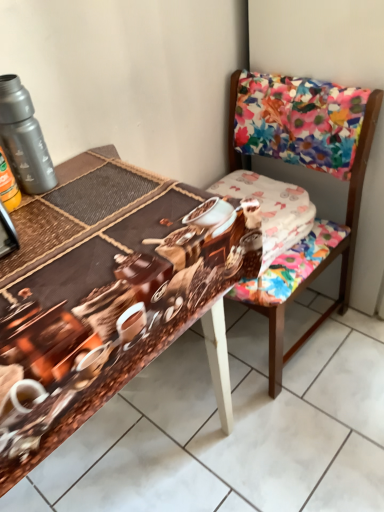
At what (x,y) coordinates should I click in order to perform the action: click on metallic gray thermos at upper left. Please return your answer as a coordinate pair (x, y). The height and width of the screenshot is (512, 384). Looking at the image, I should click on [24, 138].

The image size is (384, 512). Identify the location of brown printed fabric at center. (85, 245).

Is point (284, 229) closer or farther from the camera than point (21, 140)?

Point (284, 229) is positioned farther from the camera compared to point (21, 140).

Is white cotton fabric at center not close to metallic gray thermos at upper left?

white cotton fabric at center is near metallic gray thermos at upper left, not far away.

In terms of size, does white cotton fabric at center appear bigger or smaller than metallic gray thermos at upper left?

Clearly, white cotton fabric at center is larger in size than metallic gray thermos at upper left.

Measure the distance from white cotton fabric at center to metallic gray thermos at upper left.

A distance of 21.74 inches exists between white cotton fabric at center and metallic gray thermos at upper left.

The width and height of the screenshot is (384, 512). In order to click on table on the left of floral fabric chair at upper right in this screenshot , I will do `click(85, 245)`.

In the scene shown: Considering the relative positions of floral fabric chair at upper right and brown printed fabric at center in the image provided, is floral fabric chair at upper right in front of brown printed fabric at center?

No, floral fabric chair at upper right is further to the viewer.

Based on the photo, is brown printed fabric at center at the back of floral fabric chair at upper right?

That's not correct — floral fabric chair at upper right is not looking away from brown printed fabric at center.

From the image's perspective, is floral fabric chair at upper right under brown printed fabric at center?

No, from the image's perspective, floral fabric chair at upper right is not below brown printed fabric at center.

From the picture: From the image's perspective, who appears lower, metallic gray thermos at upper left or floral fabric chair at upper right?

floral fabric chair at upper right.

Which of these two, metallic gray thermos at upper left or floral fabric chair at upper right, stands taller?

With more height is floral fabric chair at upper right.

Is floral fabric chair at upper right at the back of metallic gray thermos at upper left?

No, metallic gray thermos at upper left is not facing the opposite direction of floral fabric chair at upper right.

Locate an element on the screen. chair behind the metallic gray thermos at upper left is located at coordinates (321, 259).

Is metallic gray thermos at upper left completely or partially inside brown printed fabric at center?

No, metallic gray thermos at upper left is not surrounded by brown printed fabric at center.

Is brown printed fabric at center facing away from metallic gray thermos at upper left?

brown printed fabric at center does not have its back to metallic gray thermos at upper left.

From the image's perspective, which is below, brown printed fabric at center or metallic gray thermos at upper left?

brown printed fabric at center appears lower in the image.

Where is `bottle that is above the brown printed fabric at center (from the image's perspective)`? bottle that is above the brown printed fabric at center (from the image's perspective) is located at coordinates (24, 138).

The width and height of the screenshot is (384, 512). Identify the location of fabric that is above the brown printed fabric at center (from the image's perspective). [x=272, y=209].

Considering the relative sizes of brown printed fabric at center and white cotton fabric at center in the image provided, is brown printed fabric at center taller than white cotton fabric at center?

Yes, brown printed fabric at center is taller than white cotton fabric at center.

How many degrees apart are the facing directions of brown printed fabric at center and white cotton fabric at center?

The facing directions of brown printed fabric at center and white cotton fabric at center are 0.97 degrees apart.

Which point is more forward, (138, 232) or (214, 187)?

The point (138, 232) is in front.

From the image's perspective, is floral fabric chair at upper right located beneath white cotton fabric at center?

Correct, floral fabric chair at upper right appears lower than white cotton fabric at center in the image.

Does floral fabric chair at upper right have a larger size compared to white cotton fabric at center?

Correct, floral fabric chair at upper right is larger in size than white cotton fabric at center.

How many degrees apart are the facing directions of floral fabric chair at upper right and white cotton fabric at center?

89 degrees.

From the image's perspective, which one is positioned higher, metallic gray thermos at upper left or brown printed fabric at center?

metallic gray thermos at upper left appears higher in the image.

Is metallic gray thermos at upper left situated inside brown printed fabric at center or outside?

metallic gray thermos at upper left lies outside brown printed fabric at center.

Is metallic gray thermos at upper left to the left or to the right of brown printed fabric at center in the image?

Based on their positions, metallic gray thermos at upper left is located to the left of brown printed fabric at center.

Can you tell me how much metallic gray thermos at upper left and brown printed fabric at center differ in facing direction?

metallic gray thermos at upper left and brown printed fabric at center are facing 0.000691 degrees away from each other.

Locate an element on the screen. Image resolution: width=384 pixels, height=512 pixels. fabric below the metallic gray thermos at upper left (from the image's perspective) is located at coordinates (272, 209).

The image size is (384, 512). What are the coordinates of `chair that is above the brown printed fabric at center (from a real-world perspective)` in the screenshot? It's located at [321, 259].

Considering their positions, is metallic gray thermos at upper left positioned closer to floral fabric chair at upper right than white cotton fabric at center?

white cotton fabric at center is closer to floral fabric chair at upper right.

Estimate the real-world distances between objects in this image. Which object is closer to metallic gray thermos at upper left, floral fabric chair at upper right or white cotton fabric at center?

The object closer to metallic gray thermos at upper left is white cotton fabric at center.

Which object lies further to the anchor point brown printed fabric at center, white cotton fabric at center or floral fabric chair at upper right?

floral fabric chair at upper right is further to brown printed fabric at center.

Which object lies nearer to the anchor point metallic gray thermos at upper left, brown printed fabric at center or floral fabric chair at upper right?

brown printed fabric at center is positioned closer to the anchor metallic gray thermos at upper left.

When comparing their distances from brown printed fabric at center, does floral fabric chair at upper right or metallic gray thermos at upper left seem closer?

metallic gray thermos at upper left is positioned closer to the anchor brown printed fabric at center.

When comparing their distances from white cotton fabric at center, does brown printed fabric at center or floral fabric chair at upper right seem closer?

Among the two, floral fabric chair at upper right is located nearer to white cotton fabric at center.

Looking at the image, which one is located closer to brown printed fabric at center, metallic gray thermos at upper left or floral fabric chair at upper right?

Among the two, metallic gray thermos at upper left is located nearer to brown printed fabric at center.

Based on their spatial positions, is metallic gray thermos at upper left or brown printed fabric at center closer to floral fabric chair at upper right?

brown printed fabric at center is positioned closer to the anchor floral fabric chair at upper right.

Image resolution: width=384 pixels, height=512 pixels. I want to click on chair between brown printed fabric at center and white cotton fabric at center in the front-back direction, so click(x=321, y=259).

In order to click on fabric located between metallic gray thermos at upper left and floral fabric chair at upper right in the left-right direction in this screenshot , I will do `click(272, 209)`.

Locate an element on the screen. This screenshot has height=512, width=384. table between metallic gray thermos at upper left and floral fabric chair at upper right in the horizontal direction is located at coordinates (85, 245).

You are a GUI agent. You are given a task and a screenshot of the screen. Output one action in this format:
    pyautogui.click(x=<x>, y=<y>)
    Task: Click on the bottle located between brown printed fabric at center and white cotton fabric at center in the depth direction
    This screenshot has width=384, height=512.
    Given the screenshot: What is the action you would take?
    pyautogui.click(x=24, y=138)